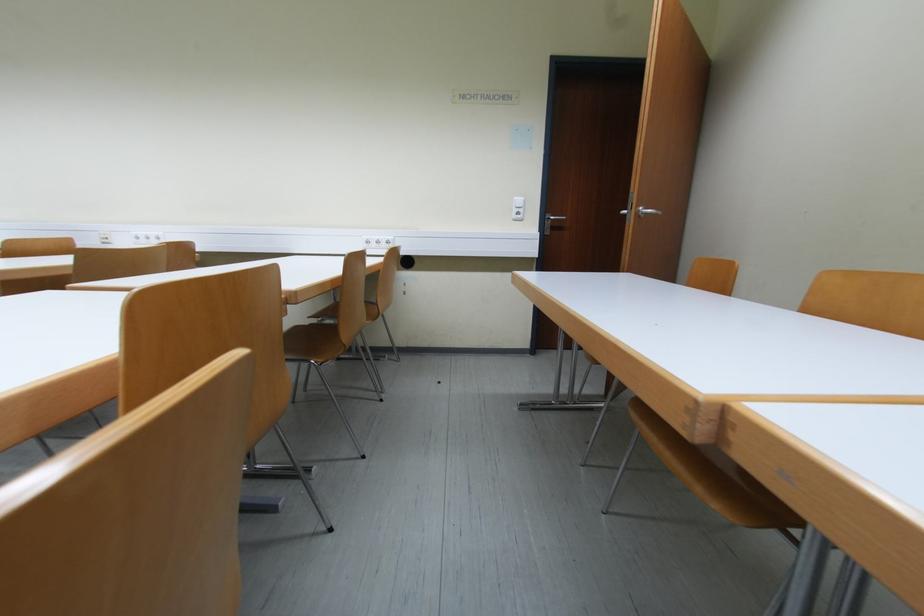
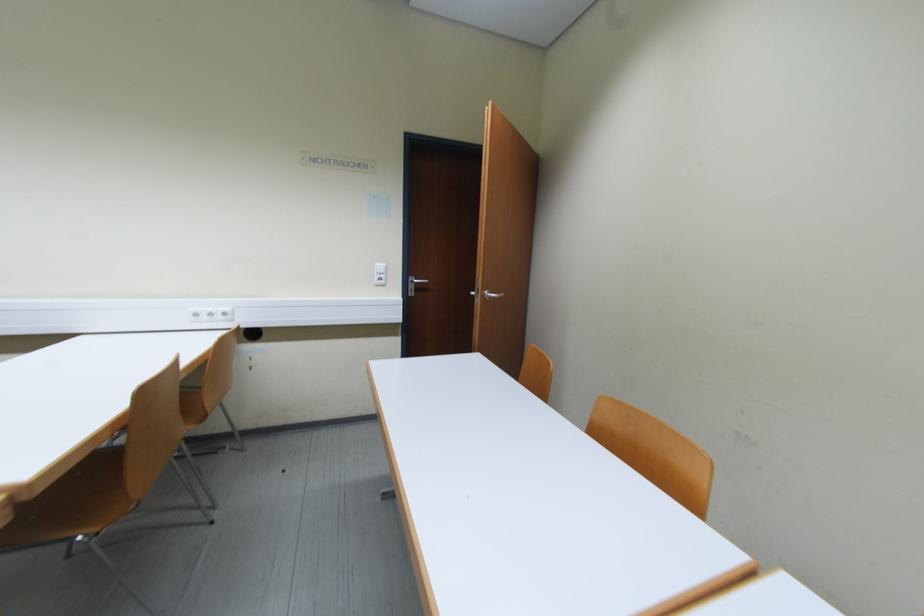
Question: The images are taken continuously from a first-person perspective. In which direction are you moving?

Choices:
 (A) Left
 (B) Right
 (C) Forward
 (D) Backward

Answer: (B)